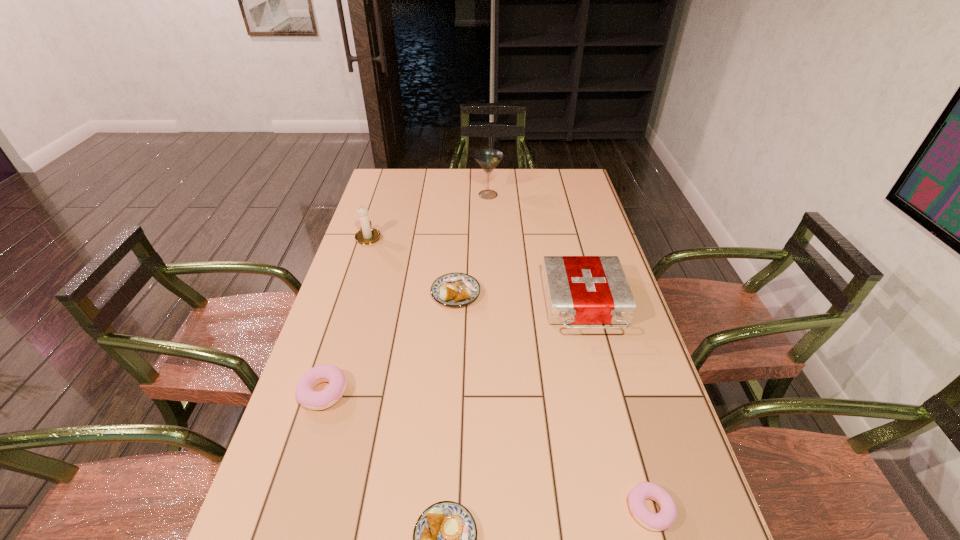
Locate an element on the screen. the nearer pink pastry is located at coordinates (666, 517).

Locate an element on the screen. The height and width of the screenshot is (540, 960). the rightmost pastry is located at coordinates (666, 517).

Locate an element on the screen. This screenshot has width=960, height=540. free space located 0.330m on the front of the farthest object is located at coordinates (490, 254).

Locate an element on the screen. This screenshot has height=540, width=960. free space located 0.310m on the handle side of the white candle holder is located at coordinates (385, 185).

Image resolution: width=960 pixels, height=540 pixels. I want to click on free location located 0.350m on the handle side of the white candle holder, so click(x=387, y=180).

The height and width of the screenshot is (540, 960). I want to click on vacant point located 0.340m on the handle side of the white candle holder, so click(x=387, y=181).

At what (x,y) coordinates should I click in order to perform the action: click on vacant space located on the front side of the red first-aid kit. Please return your answer as a coordinate pair (x, y). The height and width of the screenshot is (540, 960). Looking at the image, I should click on (618, 438).

You are a GUI agent. You are given a task and a screenshot of the screen. Output one action in this format:
    pyautogui.click(x=<x>, y=<y>)
    Task: Click on the free space located on the front of the bigger brown pastry
    This screenshot has width=960, height=540.
    Given the screenshot: What is the action you would take?
    pyautogui.click(x=449, y=403)

Find the location of a particular element. The image size is (960, 540). vacant space located 0.320m on the right of the fifth farthest object is located at coordinates pos(478,392).

Where is `free space located on the left of the shortest pastry`? free space located on the left of the shortest pastry is located at coordinates (577, 509).